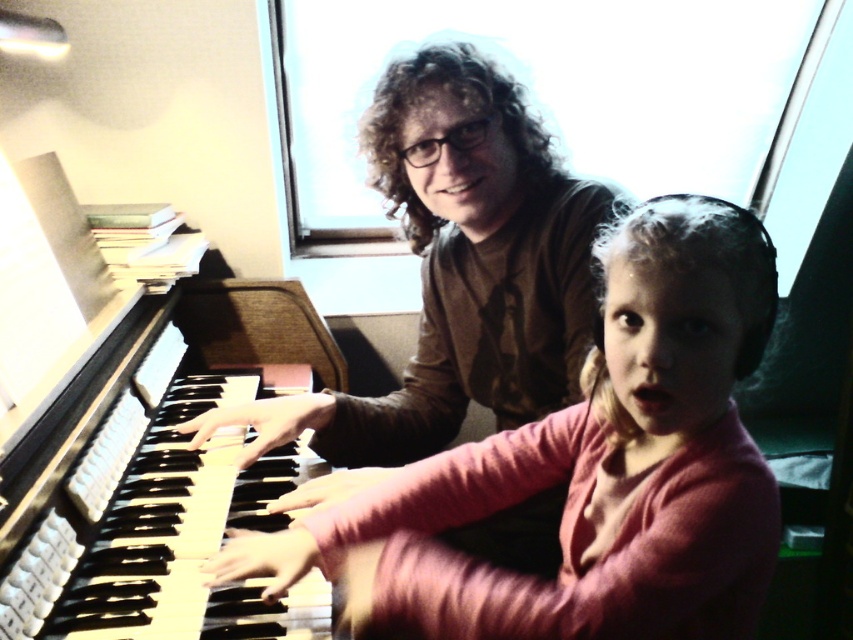
Question: Which point is closer to the camera?

Choices:
 (A) (456, 284)
 (B) (108, 467)

Answer: (B)

Question: Among these objects, which one is nearest to the camera?

Choices:
 (A) wooden piano keys at left
 (B) pink matte shirt at center
 (C) matte brown shirt at upper center

Answer: (B)

Question: Is pink matte shirt at center wider than wooden piano keys at left?

Choices:
 (A) yes
 (B) no

Answer: (A)

Question: Does wooden piano keys at left have a lesser width compared to matte brown shirt at upper center?

Choices:
 (A) yes
 (B) no

Answer: (A)

Question: Among these points, which one is farthest from the camera?

Choices:
 (A) (381, 168)
 (B) (625, 328)
 (C) (207, 492)

Answer: (C)

Question: Is wooden piano keys at left to the left of matte brown shirt at upper center from the viewer's perspective?

Choices:
 (A) yes
 (B) no

Answer: (A)